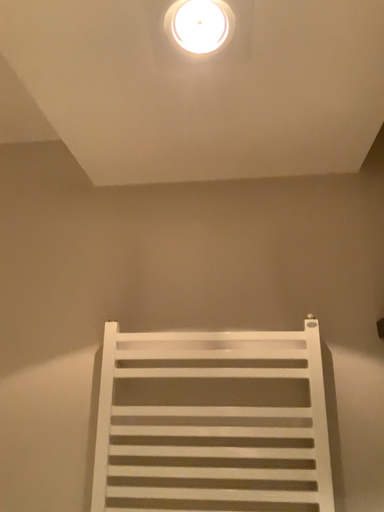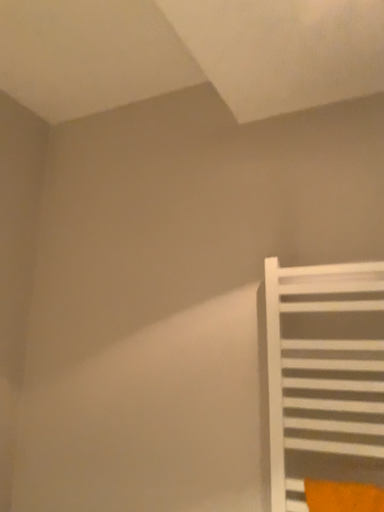
Question: How did the camera likely rotate when shooting the video?

Choices:
 (A) rotated upward
 (B) rotated downward

Answer: (B)